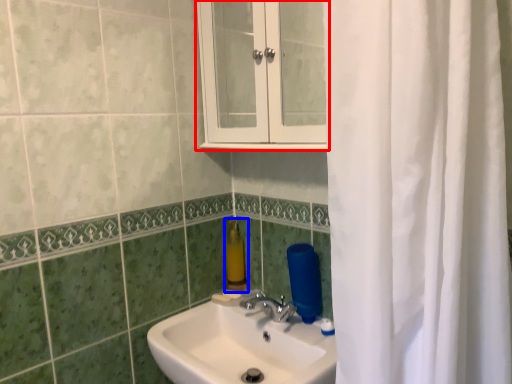
Question: Among these objects, which one is nearest to the camera, medicine cabinet (highlighted by a red box) or soap dispenser (highlighted by a blue box)?

Choices:
 (A) medicine cabinet
 (B) soap dispenser

Answer: (A)